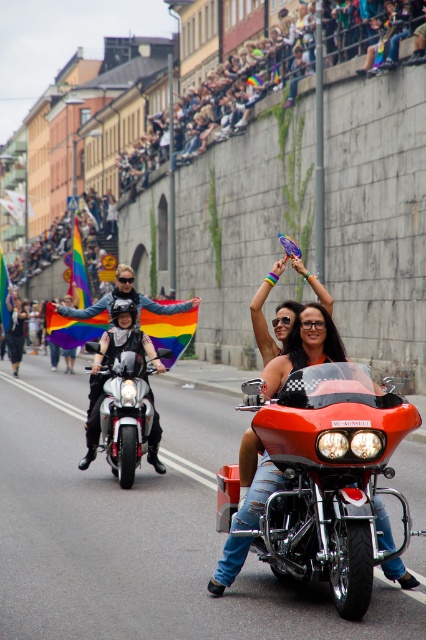
Which is more to the left, shiny red motorcycle at center or shiny chrome motorcycle at center?

Positioned to the left is shiny chrome motorcycle at center.

Find the location of a particular element. shiny red motorcycle at center is located at coordinates (325, 480).

You are a GUI agent. You are given a task and a screenshot of the screen. Output one action in this format:
    pyautogui.click(x=<x>, y=<y>)
    Task: Click on the shiny red motorcycle at center
    
    Given the screenshot: What is the action you would take?
    pyautogui.click(x=325, y=480)

Measure the distance from shiny red motorcycle at center to shiny silver motorcycle at center.

shiny red motorcycle at center is 5.26 meters from shiny silver motorcycle at center.

Which is behind, point (311, 484) or point (115, 298)?

Point (115, 298)

Locate an element on the screen. Image resolution: width=426 pixels, height=640 pixels. shiny red motorcycle at center is located at coordinates (325, 480).

Does shiny chrome motorcycle at center appear over shiny silver motorcycle at center?

No.

Between point (149, 426) and point (178, 307), which one is positioned in front?

Point (149, 426) is in front.

This screenshot has width=426, height=640. I want to click on shiny chrome motorcycle at center, so click(x=124, y=413).